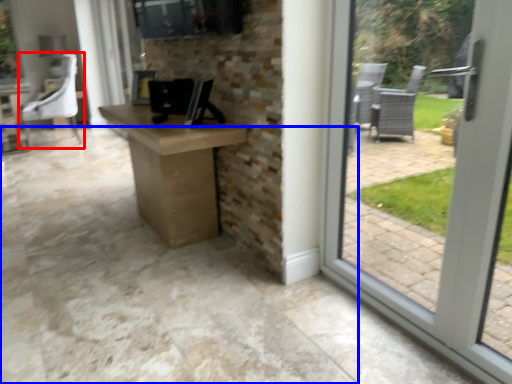
Question: Which of the following is the closest to the observer, chair (highlighted by a red box) or concrete (highlighted by a blue box)?

Choices:
 (A) chair
 (B) concrete

Answer: (B)